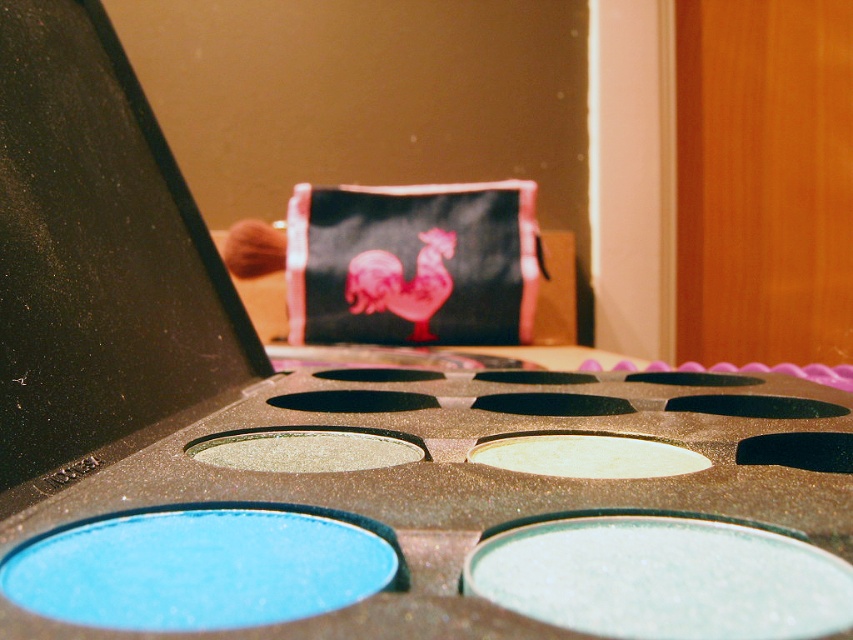
Is shimmering teal eyeshadow at center thinner than satin gold eyeshadow at center?

No, shimmering teal eyeshadow at center is not thinner than satin gold eyeshadow at center.

Does shimmering teal eyeshadow at center have a greater height compared to satin gold eyeshadow at center?

No, shimmering teal eyeshadow at center is not taller than satin gold eyeshadow at center.

Which is in front, point (608, 620) or point (694, 460)?

Positioned in front is point (608, 620).

This screenshot has width=853, height=640. I want to click on shimmering teal eyeshadow at center, so click(662, 579).

Is shimmering teal eyeshadow at center to the left of shimmering metallic eyeshadow at center from the viewer's perspective?

Incorrect, shimmering teal eyeshadow at center is not on the left side of shimmering metallic eyeshadow at center.

Can you confirm if shimmering teal eyeshadow at center is smaller than shimmering metallic eyeshadow at center?

Yes, shimmering teal eyeshadow at center is smaller than shimmering metallic eyeshadow at center.

The width and height of the screenshot is (853, 640). I want to click on shimmering teal eyeshadow at center, so click(662, 579).

Find the location of a particular element. The width and height of the screenshot is (853, 640). satin gold eyeshadow at center is located at coordinates (585, 456).

Does satin gold eyeshadow at center have a lesser width compared to shimmering metallic eyeshadow at center?

Yes.

Is point (560, 474) more distant than point (397, 448)?

That is False.

At what (x,y) coordinates should I click in order to perform the action: click on satin gold eyeshadow at center. Please return your answer as a coordinate pair (x, y). The width and height of the screenshot is (853, 640). Looking at the image, I should click on (585, 456).